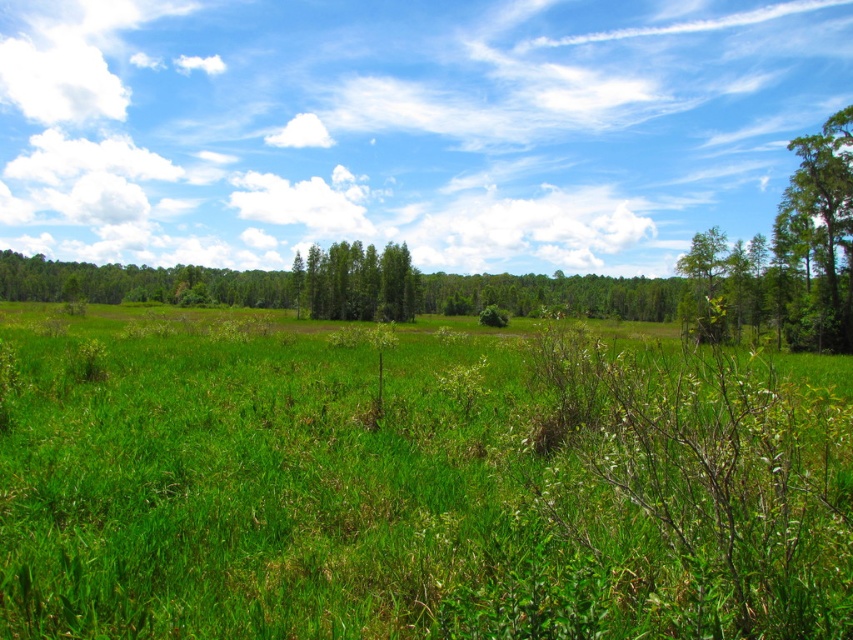
Question: Is green grassy field at center smaller than green leafy trees at center?

Choices:
 (A) no
 (B) yes

Answer: (B)

Question: Which point appears farthest from the camera in this image?

Choices:
 (A) (666, 436)
 (B) (839, 262)
 (C) (335, 268)

Answer: (C)

Question: Which object is positioned closest to the green grassy field at center?

Choices:
 (A) green leafy trees at center
 (B) green leafy tree at right

Answer: (B)

Question: Which point appears closest to the camera in this image?

Choices:
 (A) (351, 308)
 (B) (222, 401)
 (C) (827, 312)

Answer: (B)

Question: Does green leafy tree at right lie in front of green leafy trees at center?

Choices:
 (A) no
 (B) yes

Answer: (B)

Question: Is green grassy field at center to the left of green leafy tree at right from the viewer's perspective?

Choices:
 (A) no
 (B) yes

Answer: (B)